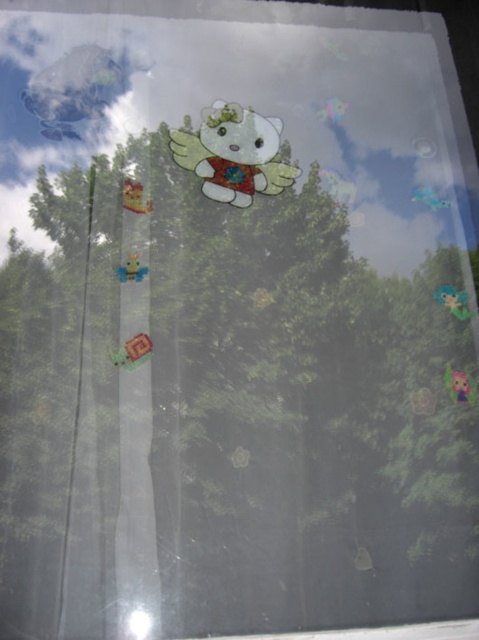
You are looking through the window and see the matte plastic hello kitty at center and the shiny metallic robot at upper left. Which object is positioned to the right side of the other?

The matte plastic hello kitty at center is positioned to the right of the shiny metallic robot at upper left.

From the picture: You are standing in a room with the window described. You want to reach the shiny metallic robot at upper left to clean it. If your arm can extend 1.5 meters, can you reach it?

The shiny metallic robot at upper left is 1.46 meters away from the camera, so yes, your arm can reach it since it extends 1.5 meters.